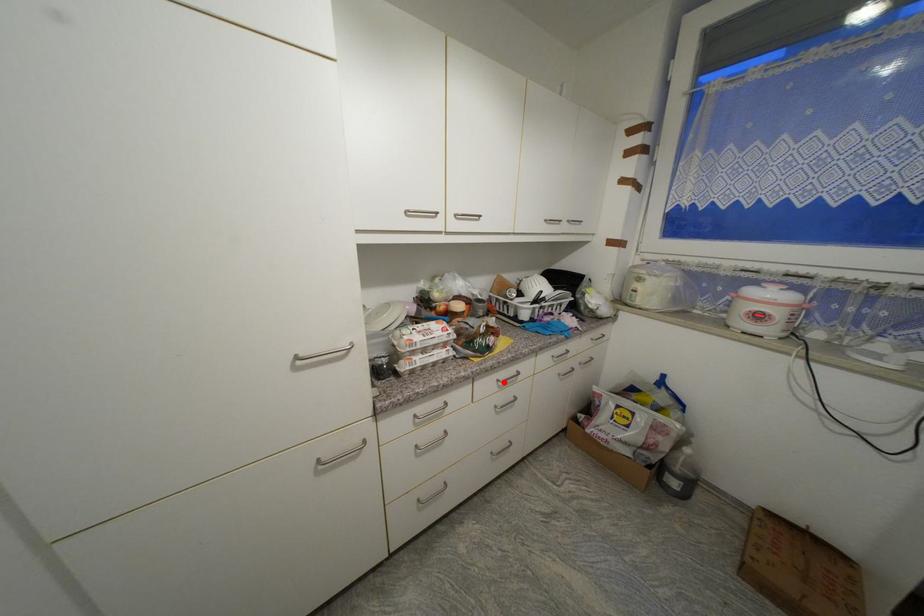
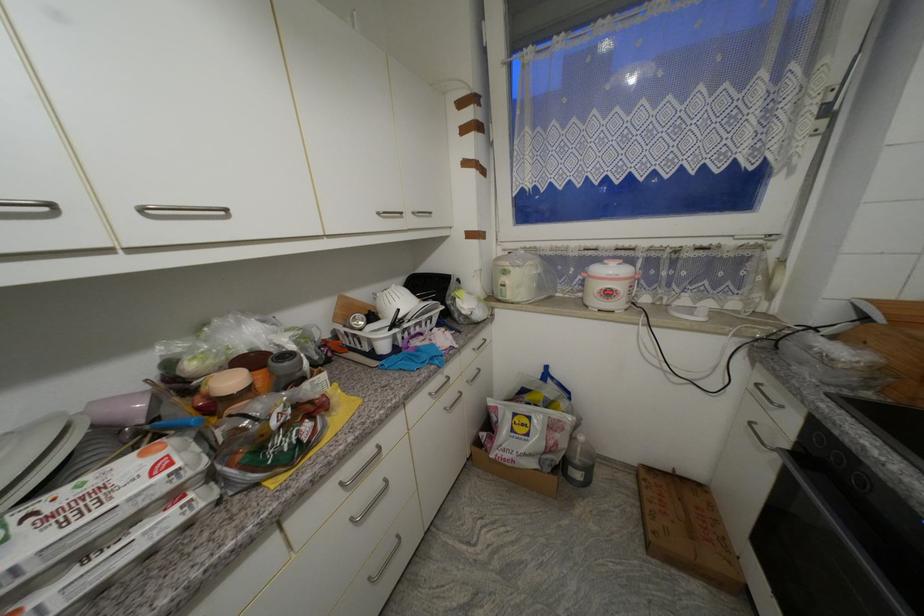
Question: I am providing you with two images of the same scene from different viewpoints. A red point is shown in image1. For the corresponding object point in image2, is it positioned nearer or farther from the camera?

Choices:
 (A) Nearer
 (B) Farther

Answer: (A)